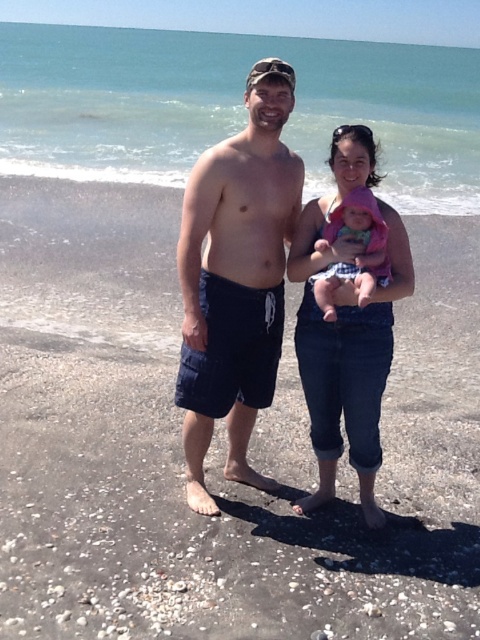
You are a photographer taking a picture of the family on the beach. You notice the smooth sand at center and the dark blue shorts at center. Which object is closer to you?

The smooth sand at center is closer to the viewer than the dark blue shorts at center.

You are a photographer trying to capture a photo of the smooth sand at center and the dark blue shorts at center. If you want to ensure both objects are in focus, which one should you adjust the camera focus on first?

The smooth sand at center is wider than dark blue shorts at center, so you should focus on the smooth sand at center first to ensure both are in focus.

You are standing at point (212,371) and want to walk to the point (385,483). Which direction should you move in relation to the beach scene?

You should move backward because point (385,483) is behind point (212,371) in the beach scene.